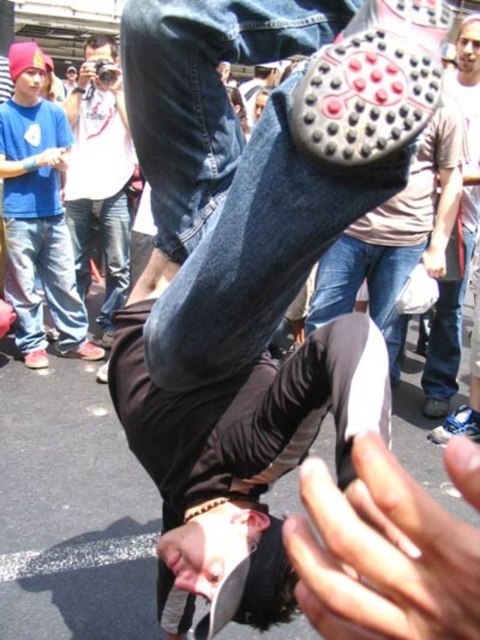
You are a photographer trying to capture the breakdancer. You notice the matte blue jeans at upper left and the matte gray shoe at upper center in your viewfinder. Which object should you focus on to ensure it appears larger in the photo?

The matte gray shoe at upper center should be focused on because it is taller than the matte blue jeans at upper left, making it appear larger in the photo.